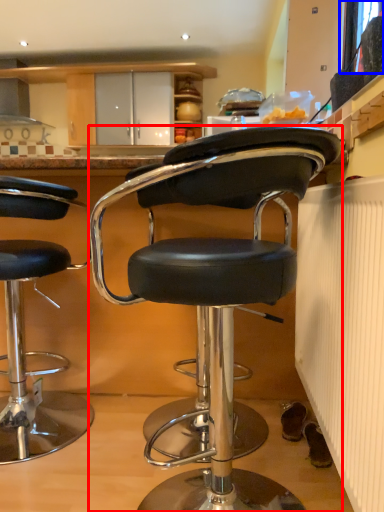
Question: Which of the following is the farthest to the observer, chair (highlighted by a red box) or window screen (highlighted by a blue box)?

Choices:
 (A) chair
 (B) window screen

Answer: (B)